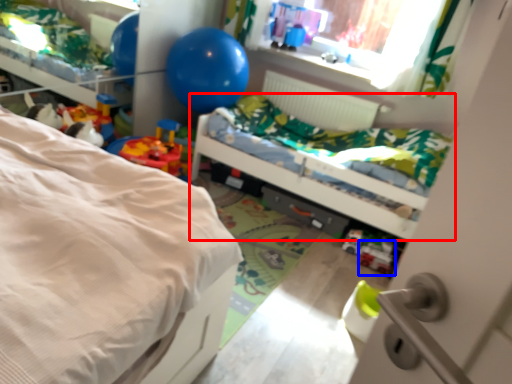
Question: Which object appears farthest to the camera in this image, bed (highlighted by a red box) or toy (highlighted by a blue box)?

Choices:
 (A) bed
 (B) toy

Answer: (B)